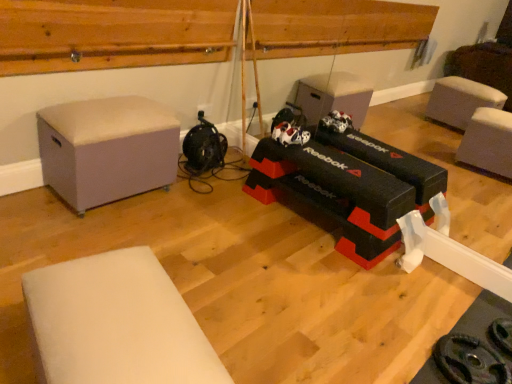
Question: Can you confirm if white foam mat at lower left, arranged as the second furniture when viewed from the top, is positioned to the right of light gray fabric ottoman at left, acting as the 2th furniture starting from the front?

Choices:
 (A) no
 (B) yes

Answer: (B)

Question: Are white foam mat at lower left, which is the 1th furniture in front-to-back order, and light gray fabric ottoman at left, arranged as the first furniture when viewed from the top, far apart?

Choices:
 (A) yes
 (B) no

Answer: (A)

Question: Is white foam mat at lower left, positioned as the 2th furniture in back-to-front order, positioned with its back to light gray fabric ottoman at left, acting as the 2th furniture starting from the front?

Choices:
 (A) no
 (B) yes

Answer: (A)

Question: Is white foam mat at lower left, the first furniture positioned from the bottom, not within light gray fabric ottoman at left, the 1th furniture positioned from the back?

Choices:
 (A) no
 (B) yes

Answer: (B)

Question: Does white foam mat at lower left, positioned as the 2th furniture in back-to-front order, have a larger size compared to light gray fabric ottoman at left, which is the 2th furniture from bottom to top?

Choices:
 (A) no
 (B) yes

Answer: (A)

Question: Is white foam mat at lower left, positioned as the 2th furniture in back-to-front order, closer to the viewer compared to light gray fabric ottoman at left, arranged as the first furniture when viewed from the top?

Choices:
 (A) yes
 (B) no

Answer: (A)

Question: Is the depth of wooden at upper center less than that of light gray fabric ottoman at left, acting as the 2th furniture starting from the front?

Choices:
 (A) no
 (B) yes

Answer: (B)

Question: Are wooden at upper center and light gray fabric ottoman at left, which is the 2th furniture from bottom to top, beside each other?

Choices:
 (A) yes
 (B) no

Answer: (B)

Question: Is wooden at upper center taller than light gray fabric ottoman at left, which is the 2th furniture from bottom to top?

Choices:
 (A) no
 (B) yes

Answer: (A)

Question: Considering the relative sizes of wooden at upper center and light gray fabric ottoman at left, which is the 2th furniture from bottom to top, in the image provided, is wooden at upper center thinner than light gray fabric ottoman at left, which is the 2th furniture from bottom to top,?

Choices:
 (A) yes
 (B) no

Answer: (A)

Question: Is light gray fabric ottoman at left, which is the 2th furniture from bottom to top, inside wooden at upper center?

Choices:
 (A) yes
 (B) no

Answer: (B)

Question: Is wooden at upper center behind light gray fabric ottoman at left, the 1th furniture positioned from the back?

Choices:
 (A) no
 (B) yes

Answer: (A)

Question: Does wooden at upper center have a greater height compared to white foam mat at lower left, positioned as the 2th furniture in back-to-front order?

Choices:
 (A) no
 (B) yes

Answer: (A)